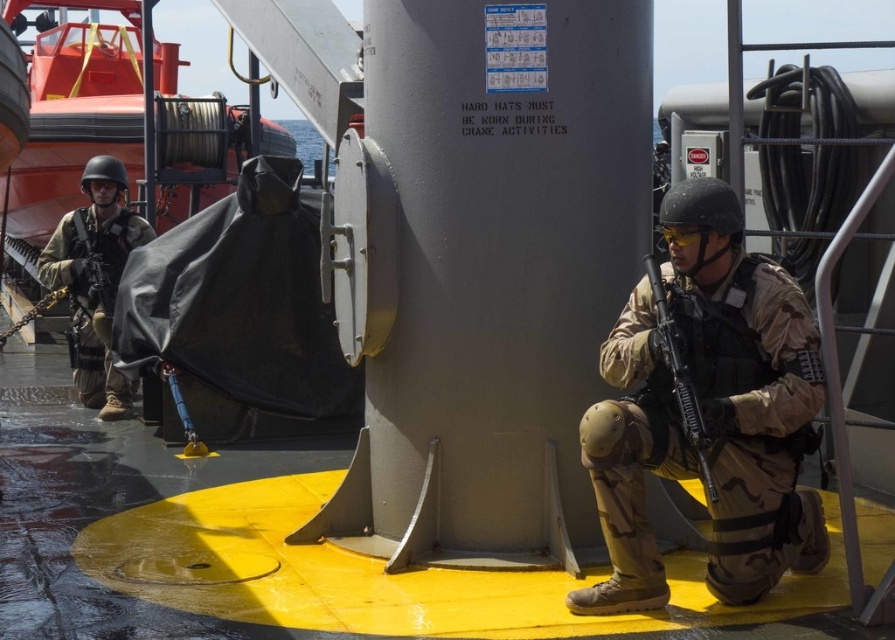
Question: Can you confirm if camouflage fabric uniform at center is positioned to the left of brushed metal lifeboat at left?

Choices:
 (A) no
 (B) yes

Answer: (A)

Question: Considering the relative positions of camouflage fabric uniform at center and camouflage fabric uniform at left in the image provided, where is camouflage fabric uniform at center located with respect to camouflage fabric uniform at left?

Choices:
 (A) right
 (B) left

Answer: (A)

Question: Is brushed metal lifeboat at left wider than matte black rifle at center?

Choices:
 (A) yes
 (B) no

Answer: (A)

Question: Estimate the real-world distances between objects in this image. Which object is farther from the camouflage fabric uniform at center?

Choices:
 (A) brushed metal lifeboat at left
 (B) matte black rifle at center

Answer: (A)

Question: Which of these objects is positioned closest to the matte black rifle at center?

Choices:
 (A) camouflage fabric uniform at center
 (B) camouflage fabric uniform at left
 (C) brushed metal lifeboat at left

Answer: (A)

Question: Which object is positioned farthest from the camouflage fabric uniform at left?

Choices:
 (A) brushed metal lifeboat at left
 (B) matte black rifle at center

Answer: (B)